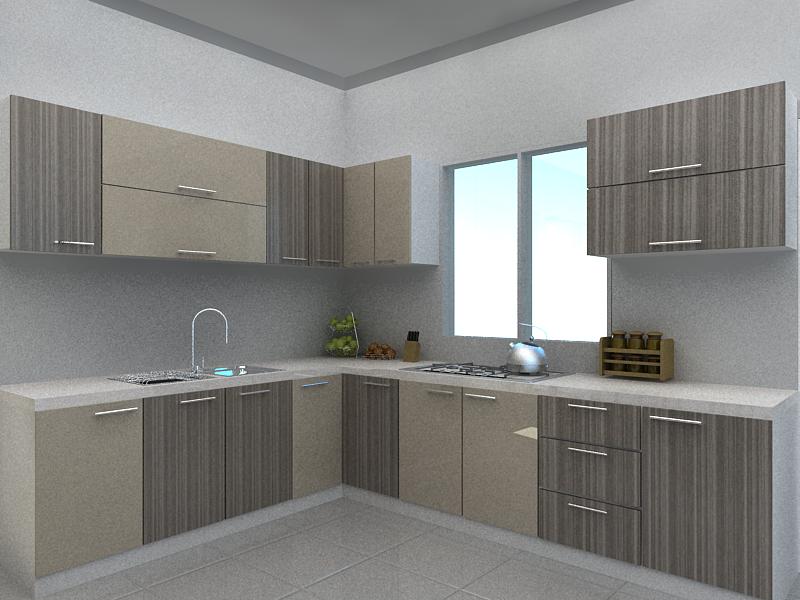
Where is `drawer`? drawer is located at coordinates (586, 479).